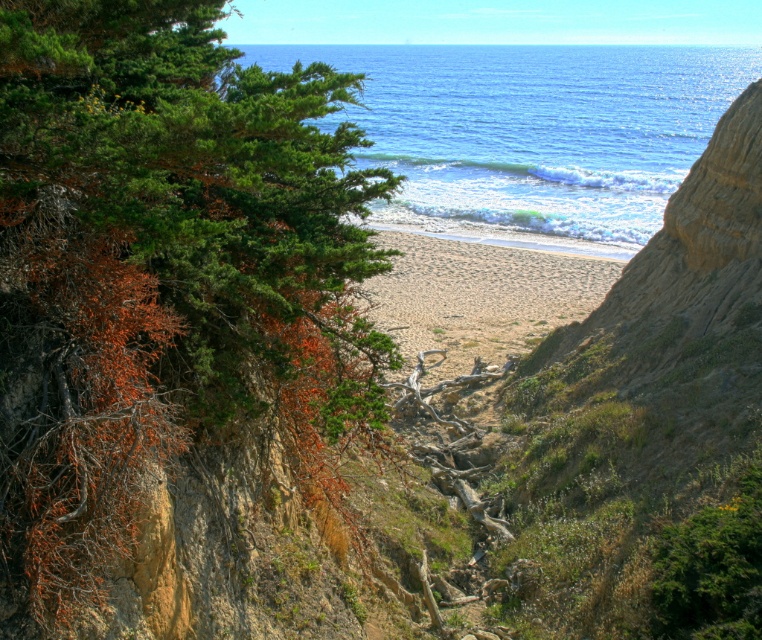
You are standing on the beach and want to walk from the green leafy tree at left to the blue water at center. Which direction should you head?

You should head to the right towards the blue water at center because the green leafy tree at left is positioned on the left side of blue water at center.

You are standing on the beach and want to take a photo of the green leafy tree at left and the blue water at center. If your camera can focus on objects up to 100 meters away, will both subjects be in focus?

The green leafy tree at left is 112.07 meters from blue water at center. Since the camera can only focus up to 100 meters, the tree is too far away to be in focus with the water.

You are standing at the center of the beach in the coastal scene. You want to take a photo of the green leafy tree at left. In which direction should you point your camera to capture it?

The green leafy tree at left is located at the left side of the frame, so you should point your camera to the left direction to capture it.